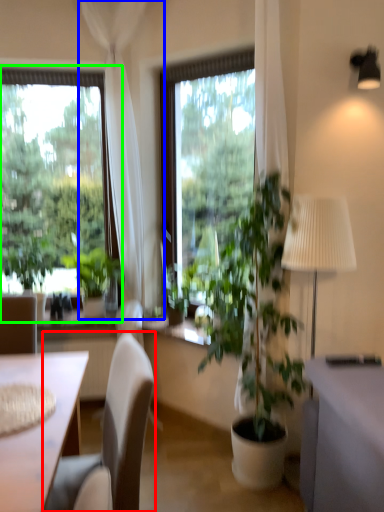
Question: Estimate the real-world distances between objects in this image. Which object is closer to chair (highlighted by a red box), curtain (highlighted by a blue box) or window (highlighted by a green box)?

Choices:
 (A) curtain
 (B) window

Answer: (A)